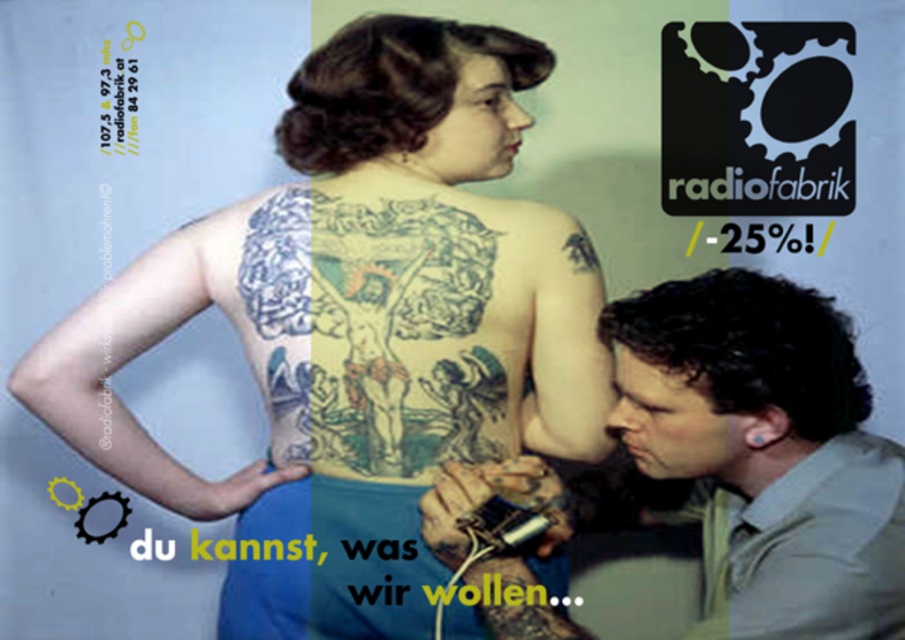
Question: Which point is farther from the camera taking this photo?

Choices:
 (A) (149, 346)
 (B) (575, 221)

Answer: (A)

Question: Does matte gray shirt at lower right appear over black ink bird at upper center?

Choices:
 (A) no
 (B) yes

Answer: (A)

Question: Does matte gray shirt at lower right have a smaller size compared to blue fabric tattoo at upper left?

Choices:
 (A) no
 (B) yes

Answer: (A)

Question: Does matte gray shirt at lower right have a smaller size compared to blue fabric tattoo at upper left?

Choices:
 (A) yes
 (B) no

Answer: (B)

Question: Which point is closer to the camera taking this photo?

Choices:
 (A) (203, 275)
 (B) (541, 545)
 (C) (588, 250)

Answer: (B)

Question: Which object appears farthest from the camera in this image?

Choices:
 (A) matte gray shirt at lower right
 (B) black ink bird at upper center
 (C) blue fabric tattoo at upper left

Answer: (C)